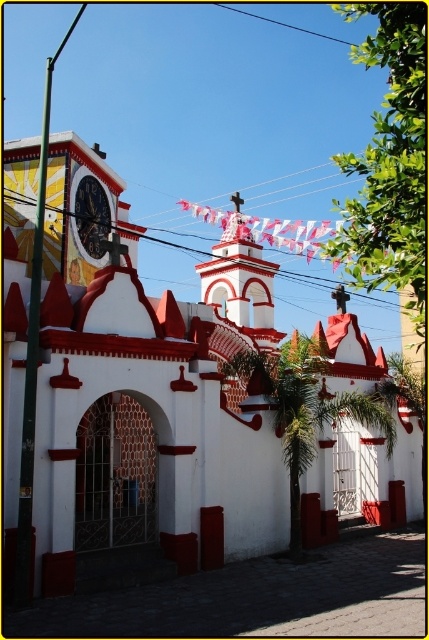
Question: Can you confirm if white matte church at center is wider than metallic clock face at upper left?

Choices:
 (A) yes
 (B) no

Answer: (A)

Question: Can you confirm if white painted stucco bell tower at center is smaller than black wire at upper center?

Choices:
 (A) yes
 (B) no

Answer: (A)

Question: Does white matte church at center have a smaller size compared to black wire at upper center?

Choices:
 (A) yes
 (B) no

Answer: (A)

Question: Among these points, which one is nearest to the camera?

Choices:
 (A) (254, 300)
 (B) (88, 195)
 (C) (27, 298)
 (D) (331, 285)

Answer: (C)

Question: Which point appears farthest from the camera in this image?

Choices:
 (A) (268, 289)
 (B) (151, 362)

Answer: (A)

Question: Which object is closer to the camera taking this photo?

Choices:
 (A) white painted stucco bell tower at center
 (B) black wire at upper center
 (C) metallic clock face at upper left

Answer: (C)